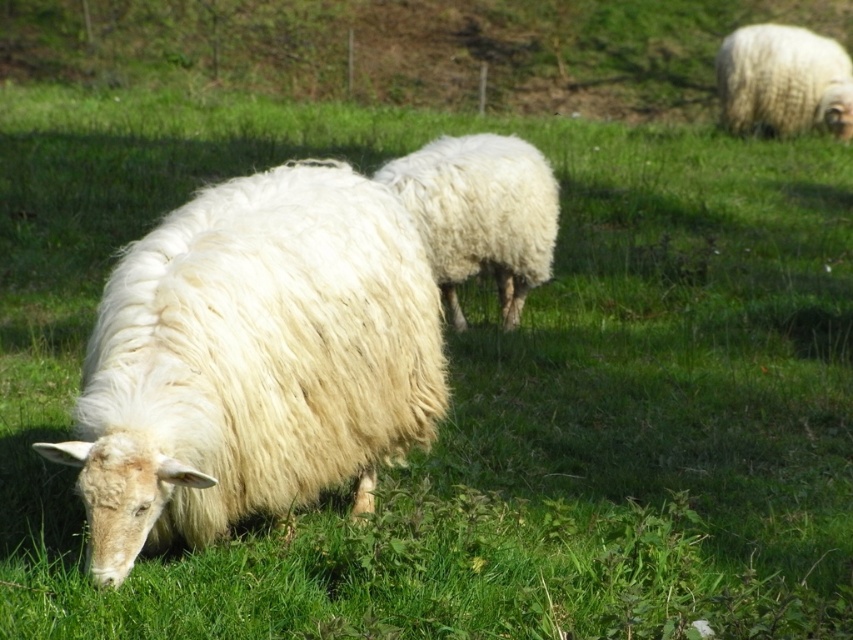
Between white fluffy sheep at center and white fluffy wool at center, which one appears on the right side from the viewer's perspective?

white fluffy wool at center

Describe the element at coordinates (253, 360) in the screenshot. I see `white fluffy sheep at center` at that location.

Does point (163, 529) come closer to viewer compared to point (527, 288)?

Yes, it is.

Locate an element on the screen. white fluffy sheep at center is located at coordinates (253, 360).

Is point (218, 257) positioned behind point (781, 132)?

No.

Find the location of a particular element. Image resolution: width=853 pixels, height=640 pixels. white fluffy sheep at center is located at coordinates click(253, 360).

Between white fluffy wool at center and white fluffy sheep at upper right, which one appears on the left side from the viewer's perspective?

white fluffy wool at center

Which is below, white fluffy wool at center or white fluffy sheep at upper right?

white fluffy wool at center

Where is `white fluffy wool at center`? Image resolution: width=853 pixels, height=640 pixels. white fluffy wool at center is located at coordinates pos(480,212).